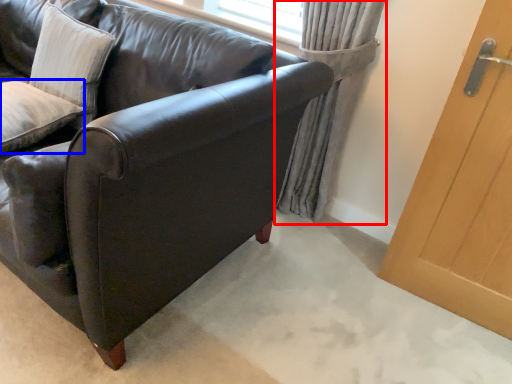
Question: Which object appears farthest to the camera in this image, curtain (highlighted by a red box) or pillow (highlighted by a blue box)?

Choices:
 (A) curtain
 (B) pillow

Answer: (A)